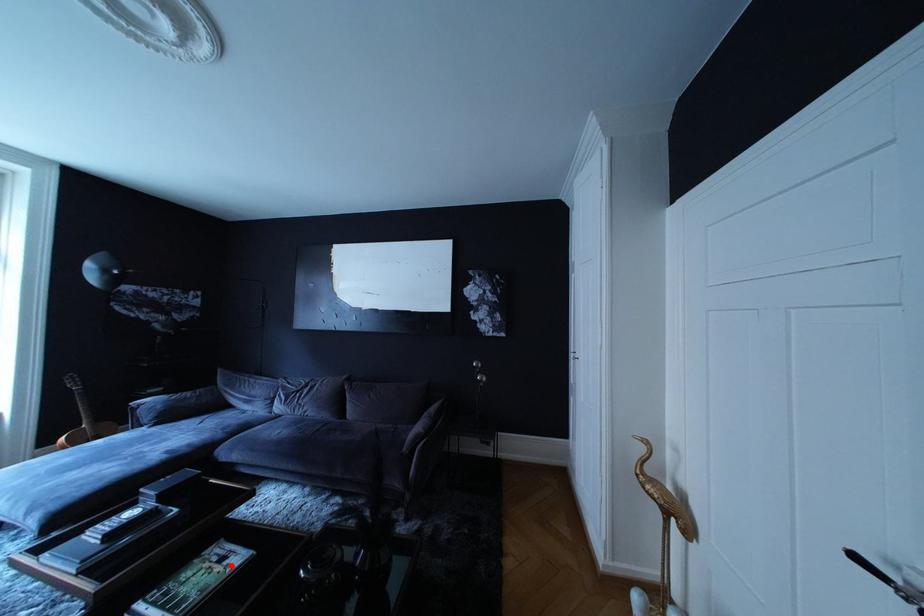
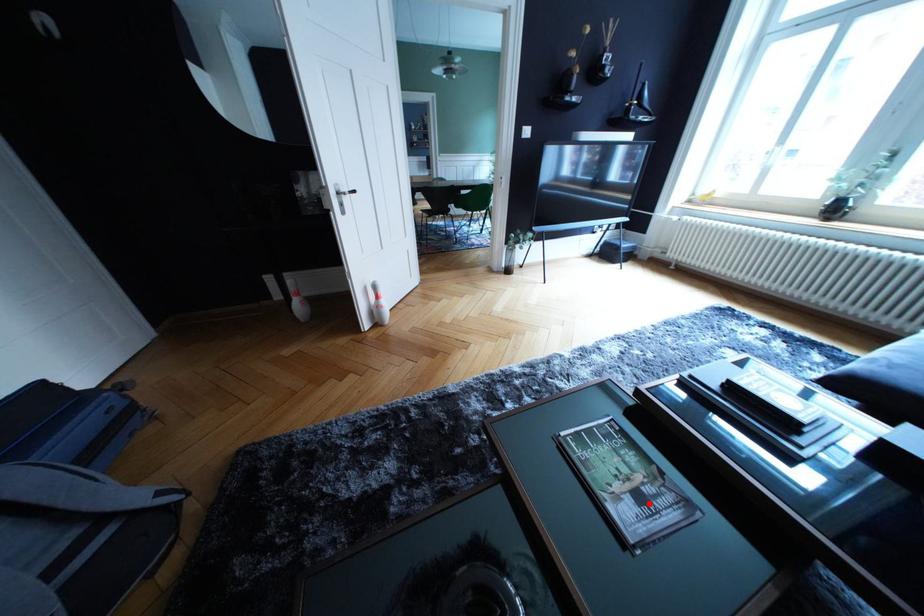
I am providing you with two images of the same scene from different viewpoints. A red point is marked on the first image and another point is marked on the second image. Are the points marked in image1 and image2 representing the same 3D position?

Yes